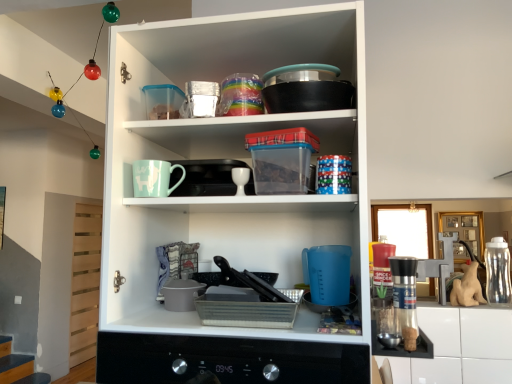
Question: Can you confirm if metallic black oven at center is thinner than matte ceramic mug at upper center?

Choices:
 (A) yes
 (B) no

Answer: (B)

Question: Considering the relative sizes of metallic black oven at center and matte ceramic mug at upper center in the image provided, is metallic black oven at center wider than matte ceramic mug at upper center?

Choices:
 (A) yes
 (B) no

Answer: (A)

Question: Is matte ceramic mug at upper center completely or partially inside metallic black oven at center?

Choices:
 (A) no
 (B) yes

Answer: (A)

Question: Is metallic black oven at center next to matte ceramic mug at upper center?

Choices:
 (A) no
 (B) yes

Answer: (A)

Question: Is metallic black oven at center positioned behind matte ceramic mug at upper center?

Choices:
 (A) no
 (B) yes

Answer: (A)

Question: Looking at their shapes, would you say metallic silver tray at lower center, the 2th appliance positioned from the top, is wider or thinner than shiny metallic container at upper center, positioned as the second tableware in bottom-to-top order?

Choices:
 (A) thin
 (B) wide

Answer: (B)

Question: Would you say metallic silver tray at lower center, the 2th appliance positioned from the top, is inside or outside shiny metallic container at upper center, which is the 2th tableware from right to left?

Choices:
 (A) outside
 (B) inside

Answer: (A)

Question: From the image's perspective, is metallic silver tray at lower center, the 1th appliance positioned from the bottom, located above or below shiny metallic container at upper center, the first tableware positioned from the left?

Choices:
 (A) above
 (B) below

Answer: (B)

Question: Is metallic silver tray at lower center, the 1th appliance positioned from the bottom, to the left or to the right of shiny metallic container at upper center, which is the 2th tableware from right to left, in the image?

Choices:
 (A) left
 (B) right

Answer: (B)

Question: Based on their positions, is shiny metallic container at upper center, which is the 2th tableware from right to left, located to the left or right of matte ceramic mug at upper center?

Choices:
 (A) left
 (B) right

Answer: (B)

Question: Based on their sizes in the image, would you say shiny metallic container at upper center, the first tableware positioned from the left, is bigger or smaller than matte ceramic mug at upper center?

Choices:
 (A) big
 (B) small

Answer: (B)

Question: Is shiny metallic container at upper center, positioned as the second tableware in bottom-to-top order, taller or shorter than matte ceramic mug at upper center?

Choices:
 (A) tall
 (B) short

Answer: (B)

Question: Considering their positions, is shiny metallic container at upper center, the first tableware positioned from the left, located in front of or behind matte ceramic mug at upper center?

Choices:
 (A) behind
 (B) front

Answer: (B)

Question: From a real-world perspective, relative to shiny metallic container at upper center, which is the 2th tableware from right to left, is matte white cupboard at center vertically above or below?

Choices:
 (A) below
 (B) above

Answer: (A)

Question: Considering the positions of matte white cupboard at center and shiny metallic container at upper center, the 1th tableware viewed from the top, in the image, is matte white cupboard at center taller or shorter than shiny metallic container at upper center, the 1th tableware viewed from the top,?

Choices:
 (A) tall
 (B) short

Answer: (A)